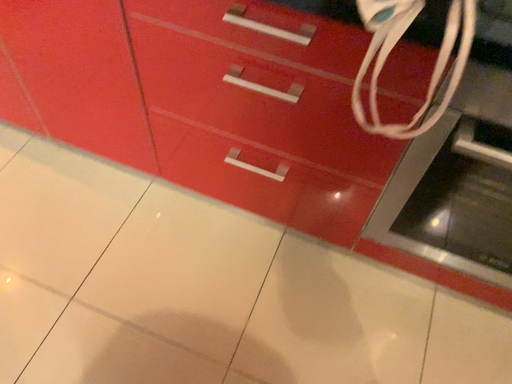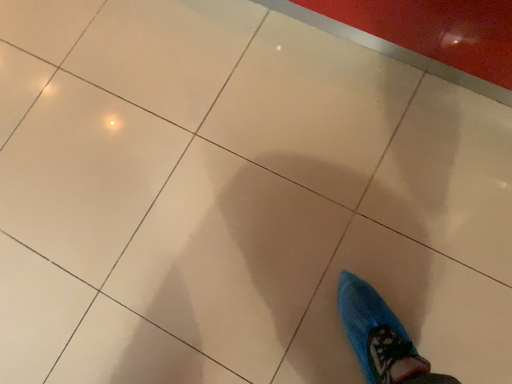
Question: Which way did the camera rotate in the video?

Choices:
 (A) rotated downward
 (B) rotated upward

Answer: (A)